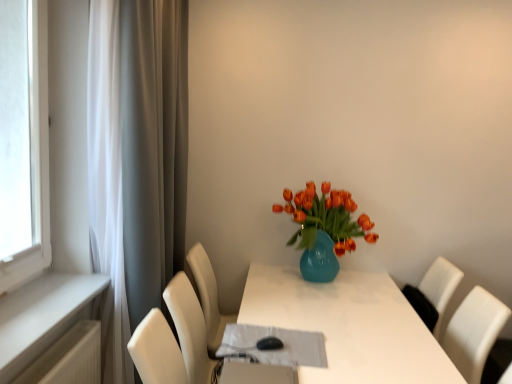
Find the location of a particular element. vacant region above white glossy table at center (from a real-world perspective) is located at coordinates (346, 307).